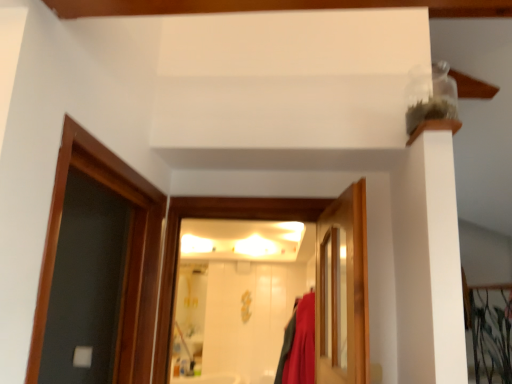
Question: Does white glossy door at center, positioned as the 2th door in right-to-left order, come behind wooden door at center, positioned as the second door in left-to-right order?

Choices:
 (A) no
 (B) yes

Answer: (B)

Question: Is white glossy door at center, which ranks as the 1th door in left-to-right order, bigger than wooden door at center, positioned as the second door in left-to-right order?

Choices:
 (A) no
 (B) yes

Answer: (B)

Question: From the image's perspective, would you say white glossy door at center, positioned as the 2th door in right-to-left order, is positioned over wooden door at center, which appears as the first door when viewed from the right?

Choices:
 (A) no
 (B) yes

Answer: (A)

Question: Can you confirm if white glossy door at center, which ranks as the 1th door in left-to-right order, is thinner than wooden door at center, positioned as the second door in left-to-right order?

Choices:
 (A) no
 (B) yes

Answer: (A)

Question: Does white glossy door at center, which ranks as the 1th door in left-to-right order, appear on the left side of wooden door at center, positioned as the second door in left-to-right order?

Choices:
 (A) yes
 (B) no

Answer: (A)

Question: Can you see white glossy door at center, which ranks as the 1th door in left-to-right order, touching wooden door at center, which appears as the first door when viewed from the right?

Choices:
 (A) yes
 (B) no

Answer: (B)

Question: Is wooden door at center, which appears as the first door when viewed from the right, outside of white glossy door at center, which ranks as the 1th door in left-to-right order?

Choices:
 (A) no
 (B) yes

Answer: (B)

Question: From a real-world perspective, is wooden door at center, which appears as the first door when viewed from the right, beneath white glossy door at center, which ranks as the 1th door in left-to-right order?

Choices:
 (A) yes
 (B) no

Answer: (A)

Question: Does wooden door at center, positioned as the second door in left-to-right order, have a smaller size compared to white glossy door at center, positioned as the 2th door in right-to-left order?

Choices:
 (A) no
 (B) yes

Answer: (B)

Question: Considering the relative sizes of wooden door at center, positioned as the second door in left-to-right order, and white glossy door at center, positioned as the 2th door in right-to-left order, in the image provided, is wooden door at center, positioned as the second door in left-to-right order, shorter than white glossy door at center, positioned as the 2th door in right-to-left order,?

Choices:
 (A) yes
 (B) no

Answer: (A)

Question: Can you confirm if wooden door at center, which appears as the first door when viewed from the right, is positioned to the right of white glossy door at center, positioned as the 2th door in right-to-left order?

Choices:
 (A) no
 (B) yes

Answer: (B)

Question: From the image's perspective, is wooden door at center, positioned as the second door in left-to-right order, above white glossy door at center, which ranks as the 1th door in left-to-right order?

Choices:
 (A) yes
 (B) no

Answer: (A)

Question: Visually, is wooden door at center, positioned as the second door in left-to-right order, positioned to the left or to the right of white glossy door at center, which ranks as the 1th door in left-to-right order?

Choices:
 (A) right
 (B) left

Answer: (A)